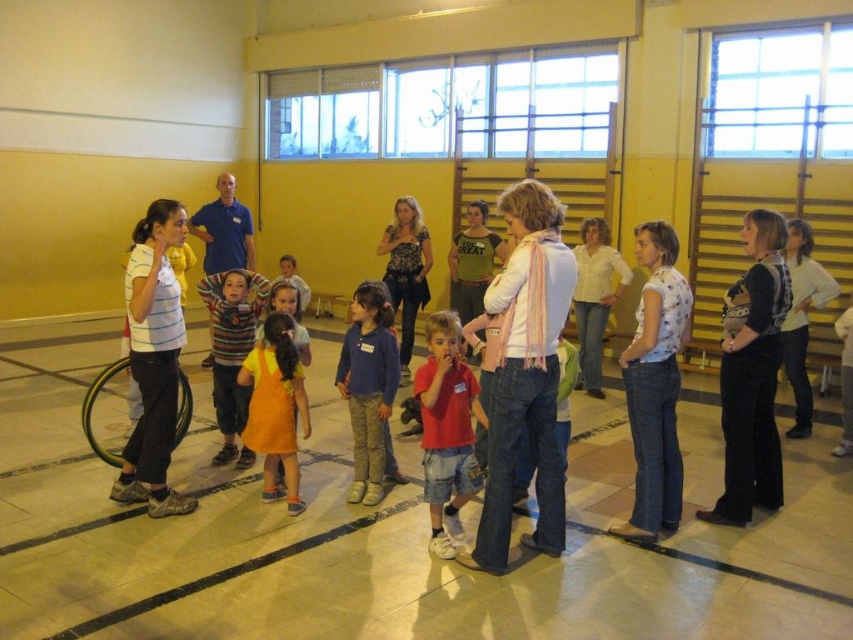
Question: From the image, what is the correct spatial relationship of red cotton shirt at center in relation to orange cotton dress at center?

Choices:
 (A) left
 (B) right

Answer: (B)

Question: Estimate the real-world distances between objects in this image. Which object is closer to the blue shirt at center?

Choices:
 (A) blue cotton shirt at center
 (B) red cotton shirt at center
 (C) orange cotton dress at center
 (D) white cotton shirt at center

Answer: (C)

Question: Which point is closer to the camera taking this photo?

Choices:
 (A) tap(352, 500)
 (B) tap(653, 456)
 (C) tap(459, 476)

Answer: (C)

Question: Is white cotton shirt at center below blue cotton shirt at center?

Choices:
 (A) no
 (B) yes

Answer: (A)

Question: Among these objects, which one is farthest from the camera?

Choices:
 (A) pink scarf at center
 (B) blue cotton shirt at center
 (C) orange cotton dress at center
 (D) white cotton shirt at center

Answer: (B)

Question: Can you confirm if black matte pants at right is thinner than red cotton shirt at center?

Choices:
 (A) yes
 (B) no

Answer: (B)